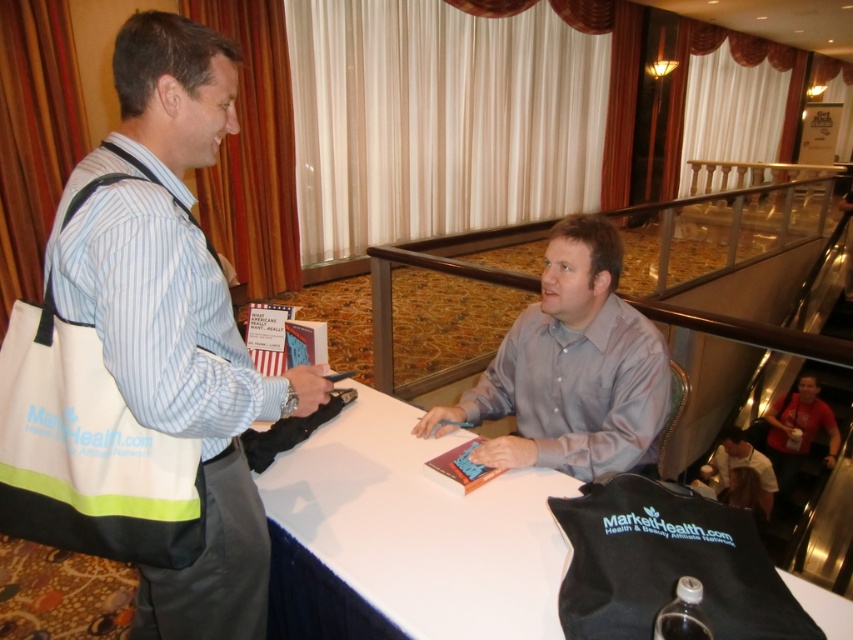
You are a photographer at the event and want to capture a photo of the light gray satin shirt at center and the light brown leather jacket at lower right. Which object should you focus on first if you want to ensure both are in focus without moving the camera?

The light gray satin shirt at center is above the light brown leather jacket at lower right, so focusing on the light gray satin shirt at center first would ensure both are in focus since it is closer to the camera.

Looking at this image, you are organizing an event and need to place a decorative centerpiece on the table. Considering the placement of the white canvas tote bag at left and the white smooth table at center, where should you position the centerpiece to ensure it doesn not block the tote bag?

The white canvas tote bag at left is to the left of the white smooth table at center, so placing the centerpiece on the right side of the white smooth table at center would avoid blocking the tote bag.